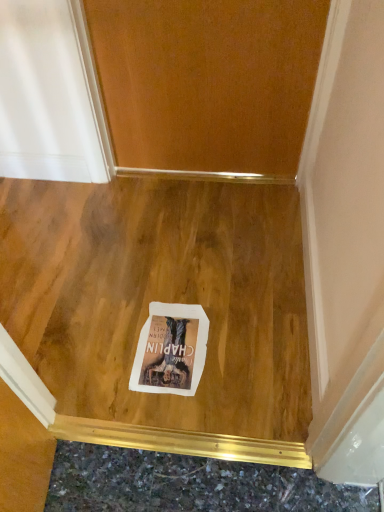
Question: From a real-world perspective, relative to white paper postcard at center, is wooden door at center vertically above or below?

Choices:
 (A) above
 (B) below

Answer: (A)

Question: Would you say wooden door at center is inside or outside white paper postcard at center?

Choices:
 (A) inside
 (B) outside

Answer: (B)

Question: Which is farther from the wooden floor at center?

Choices:
 (A) wooden door at center
 (B) white paper postcard at center

Answer: (A)

Question: Which object is positioned closest to the white paper postcard at center?

Choices:
 (A) wooden floor at center
 (B) wooden door at center

Answer: (A)